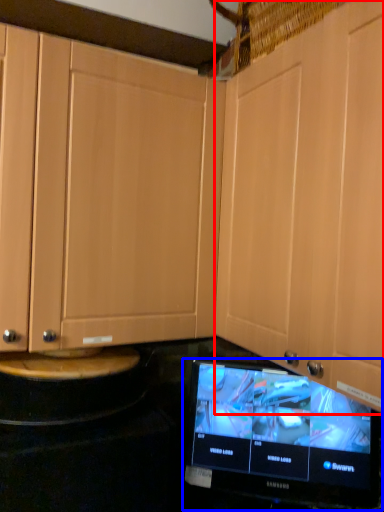
Question: Which point is further to the camera, cabinetry (highlighted by a red box) or television (highlighted by a blue box)?

Choices:
 (A) cabinetry
 (B) television

Answer: (B)